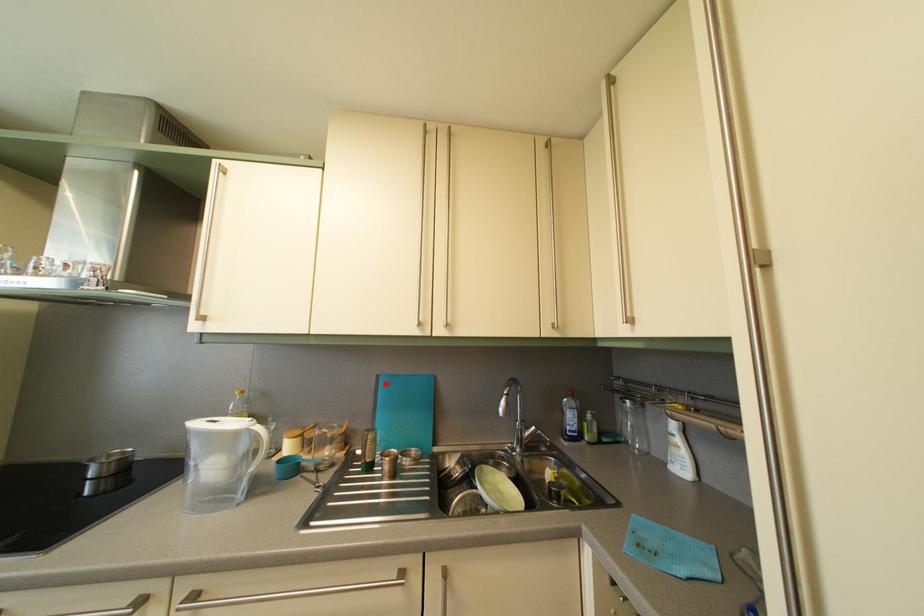
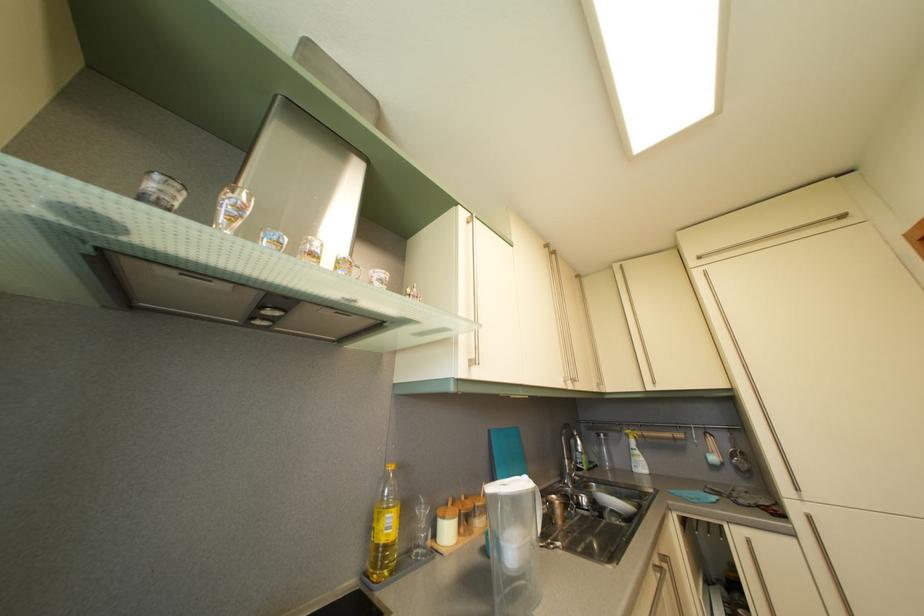
The point at the highlighted location is marked in the first image. Where is the corresponding point in the second image?

(497, 439)